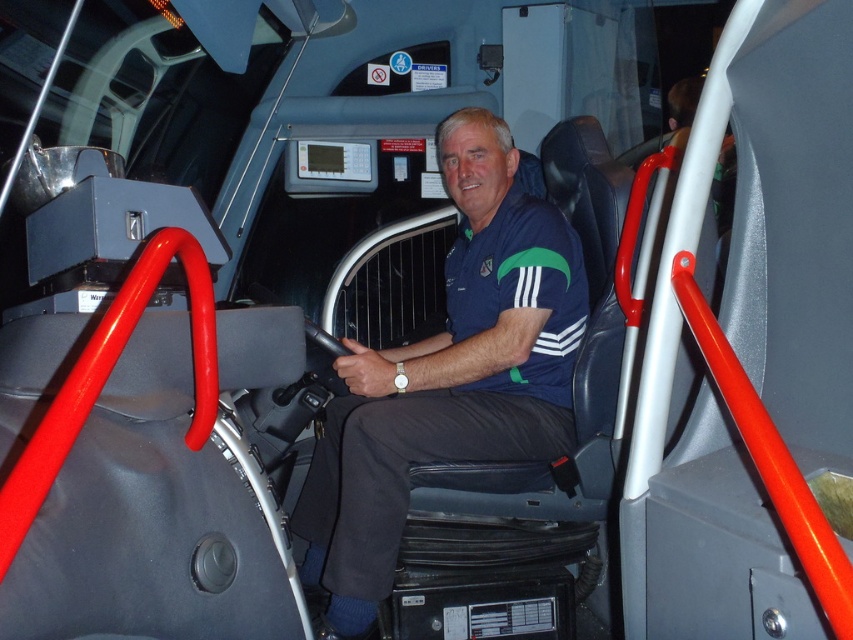
What object is located at the coordinates point (447, 376) in the image?

The point (447, 376) corresponds to the blue fabric shirt at center.

You are a passenger on a bus and need to reach a grab bar while standing between two points. The first point is at coordinate point (567, 369) and the second is at point (495, 234). Which coordinate point is closer to the front of the bus?

Point (567, 369) is in front of point (495, 234), so the coordinate point (567, 369) is closer to the front of the bus.